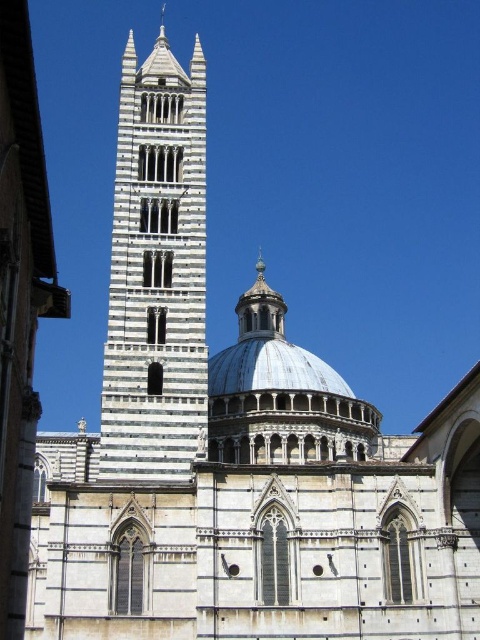
Is white marble tower at center further to the viewer compared to metallic silver dome at center?

That is False.

Is white marble tower at center closer to camera compared to metallic silver dome at center?

That is True.

Locate an element on the screen. The width and height of the screenshot is (480, 640). white marble tower at center is located at coordinates (156, 272).

The image size is (480, 640). In order to click on white marble tower at center in this screenshot , I will do `click(156, 272)`.